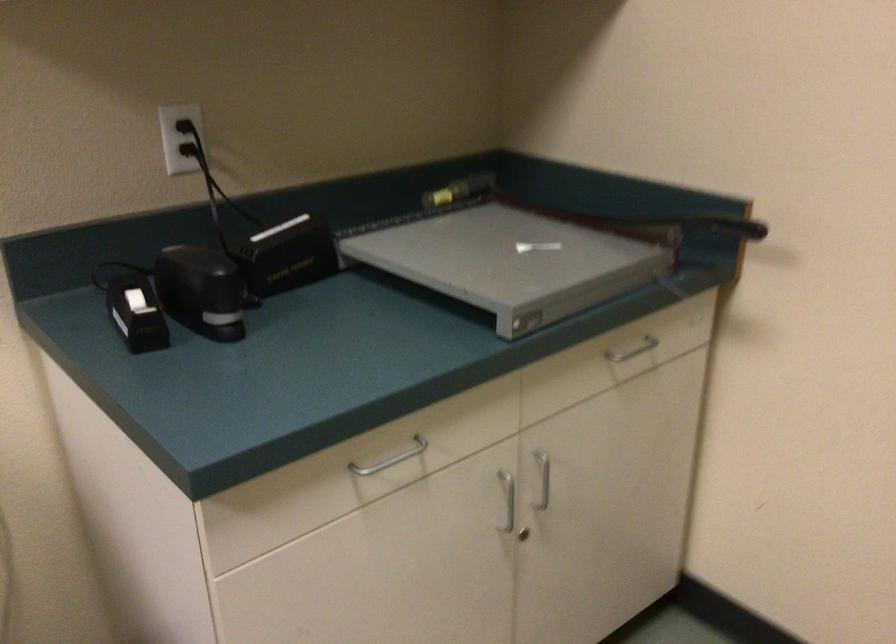
You are a GUI agent. You are given a task and a screenshot of the screen. Output one action in this format:
    pyautogui.click(x=<x>, y=<y>)
    Task: Click on the metal drawer handle
    The height and width of the screenshot is (644, 896).
    Given the screenshot: What is the action you would take?
    pyautogui.click(x=391, y=459)